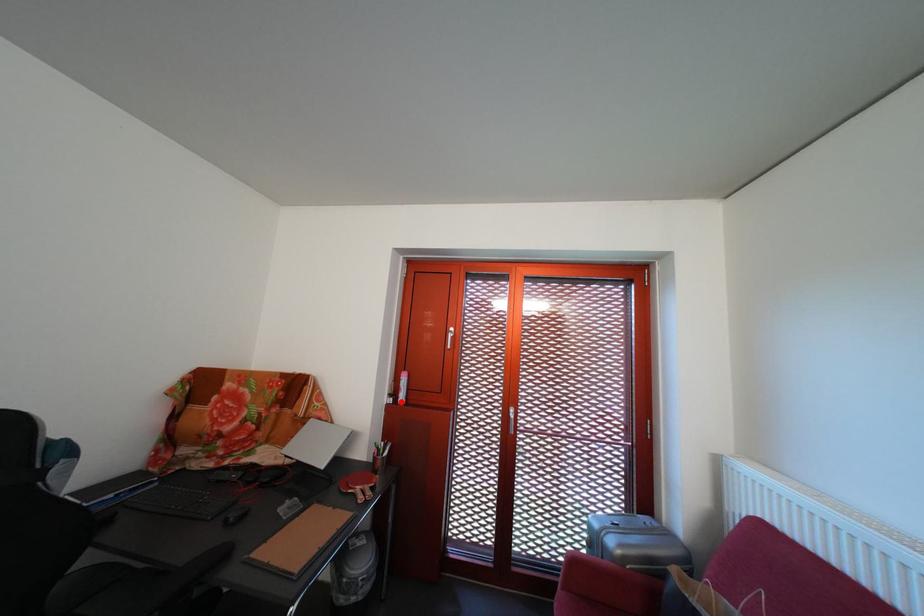
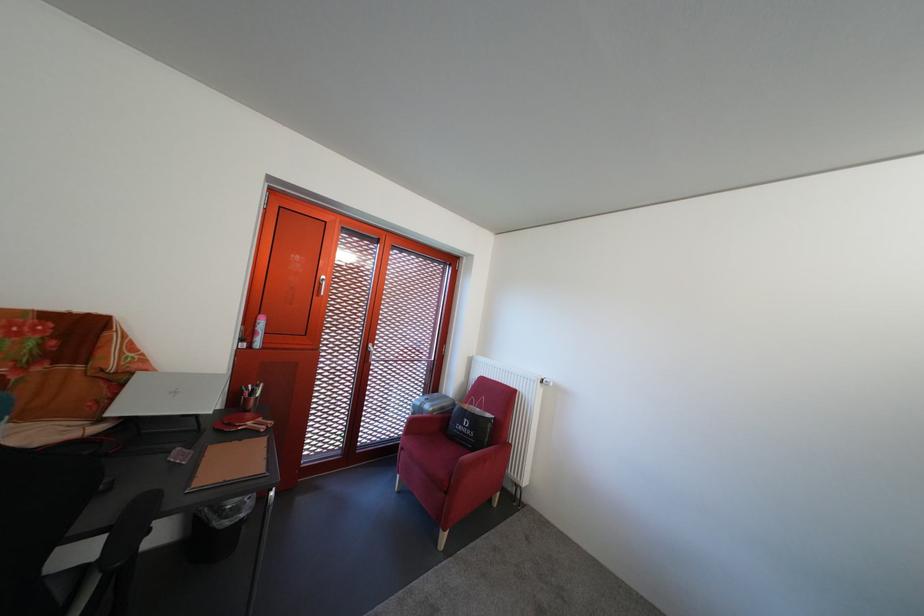
Question: I am providing you with two images of the same scene from different viewpoints. Given a red point in image1, look at the same physical point in image2. Is it:

Choices:
 (A) Closer to the viewpoint
 (B) Farther from the viewpoint

Answer: (A)